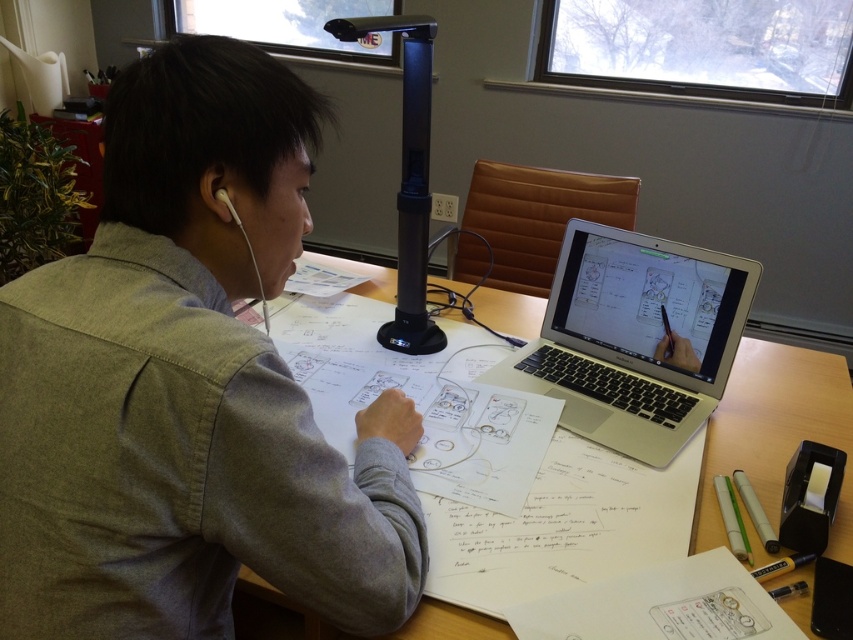
Question: Which of the following is the closest to the observer?

Choices:
 (A) wooden table at center
 (B) white matte earphone at upper left
 (C) gray cotton shirt at center
 (D) silver metallic laptop at center

Answer: (C)

Question: Among these points, which one is nearest to the camera?

Choices:
 (A) (641, 358)
 (B) (471, 630)
 (C) (233, 211)
 (D) (149, 566)

Answer: (D)

Question: Can you confirm if gray cotton shirt at center is positioned to the right of white matte earphone at upper left?

Choices:
 (A) yes
 (B) no

Answer: (A)

Question: Is gray cotton shirt at center smaller than white matte earphone at upper left?

Choices:
 (A) no
 (B) yes

Answer: (A)

Question: Which is farther from the gray cotton shirt at center?

Choices:
 (A) black plastic table lamp at center
 (B) wooden table at center
 (C) silver metallic laptop at center
 (D) white matte earphone at upper left

Answer: (B)

Question: Is gray cotton shirt at center wider than wooden table at center?

Choices:
 (A) no
 (B) yes

Answer: (A)